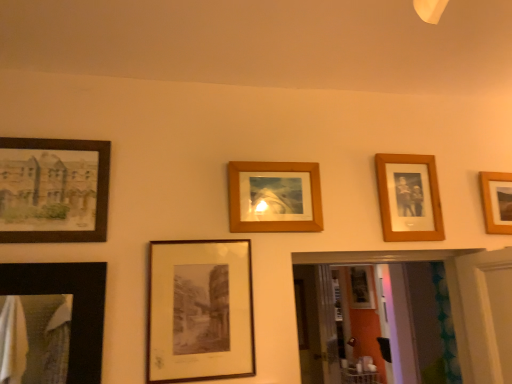
Question: Is wooden photo frame at upper right, the 2th picture frame from the right, bigger or smaller than wooden frame at upper right, the 5th picture frame positioned from the left?

Choices:
 (A) small
 (B) big

Answer: (B)

Question: From the image's perspective, is wooden photo frame at upper right, the fourth picture frame positioned from the left, located above or below wooden frame at upper right, the 5th picture frame positioned from the left?

Choices:
 (A) above
 (B) below

Answer: (A)

Question: Estimate the real-world distances between objects in this image. Which object is closer to the matte black painting at left, the first picture frame viewed from the left?

Choices:
 (A) wooden frame at upper right, acting as the first picture frame starting from the right
 (B) matte black frame at center, marked as the 4th picture frame in a right-to-left arrangement
 (C) wooden frame at center, which is the 3th picture frame from left to right
 (D) wooden photo frame at upper right, the fourth picture frame positioned from the left

Answer: (B)

Question: Considering the real-world distances, which object is closest to the wooden frame at center, which is the 3th picture frame from left to right?

Choices:
 (A) matte black painting at left, the first picture frame viewed from the left
 (B) wooden frame at upper right, the 5th picture frame positioned from the left
 (C) wooden photo frame at upper right, the 2th picture frame from the right
 (D) matte black frame at center, acting as the 2th picture frame starting from the left

Answer: (D)